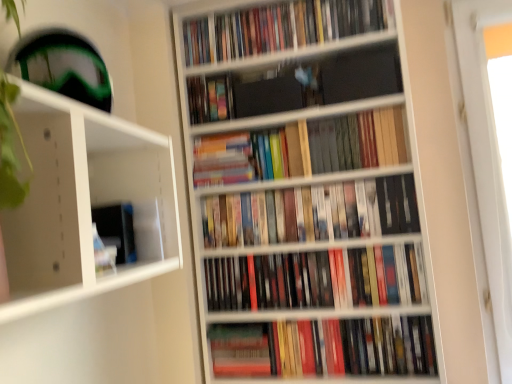
Question: Is hardcover book at center, which appears as the 1th book when ordered from the bottom, behind multicolored hardcover books at center, the second book when ordered from top to bottom?

Choices:
 (A) yes
 (B) no

Answer: (B)

Question: Is hardcover book at center, which appears as the 1th book when ordered from the bottom, far from multicolored hardcover books at center, arranged as the 6th book when ordered from the bottom?

Choices:
 (A) yes
 (B) no

Answer: (B)

Question: Can you confirm if hardcover book at center, which is the seventh book in top-to-bottom order, is thinner than multicolored hardcover books at center, the second book when ordered from top to bottom?

Choices:
 (A) no
 (B) yes

Answer: (A)

Question: Can you confirm if hardcover book at center, which is the seventh book in top-to-bottom order, is bigger than multicolored hardcover books at center, arranged as the 6th book when ordered from the bottom?

Choices:
 (A) no
 (B) yes

Answer: (B)

Question: Is hardcover book at center, which is the seventh book in top-to-bottom order, positioned with its back to multicolored hardcover books at center, the second book when ordered from top to bottom?

Choices:
 (A) no
 (B) yes

Answer: (A)

Question: From the image's perspective, is hardcover book at center, which appears as the 1th book when ordered from the bottom, on multicolored hardcover books at center, arranged as the 6th book when ordered from the bottom?

Choices:
 (A) no
 (B) yes

Answer: (A)

Question: Is hardcover book at center not close to hardcover books at center, the 3th book positioned from the top?

Choices:
 (A) no
 (B) yes

Answer: (A)

Question: Does hardcover book at center have a lesser width compared to hardcover books at center, marked as the fifth book in a bottom-to-top arrangement?

Choices:
 (A) yes
 (B) no

Answer: (A)

Question: From the image's perspective, would you say hardcover book at center is shown under hardcover books at center, the 3th book positioned from the top?

Choices:
 (A) yes
 (B) no

Answer: (A)

Question: Is hardcover book at center bigger than hardcover books at center, marked as the fifth book in a bottom-to-top arrangement?

Choices:
 (A) no
 (B) yes

Answer: (A)

Question: Does hardcover book at center appear on the right side of hardcover books at center, the 3th book positioned from the top?

Choices:
 (A) yes
 (B) no

Answer: (B)

Question: From a real-world perspective, is hardcover book at center positioned over hardcover books at center, the 3th book positioned from the top, based on gravity?

Choices:
 (A) yes
 (B) no

Answer: (B)

Question: Is multicolored hardcover books at center, the second book when ordered from top to bottom, taller than wooden bookshelf at center?

Choices:
 (A) no
 (B) yes

Answer: (A)